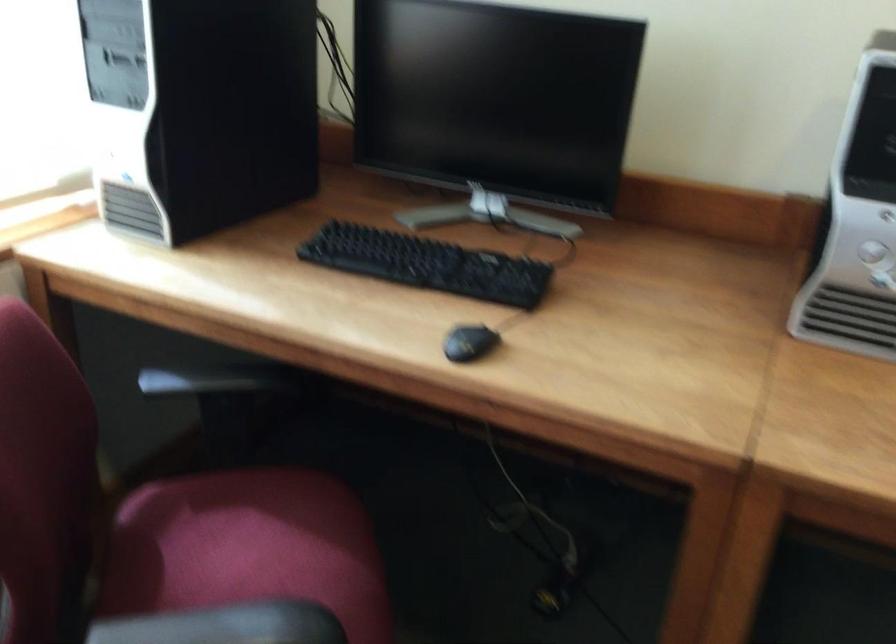
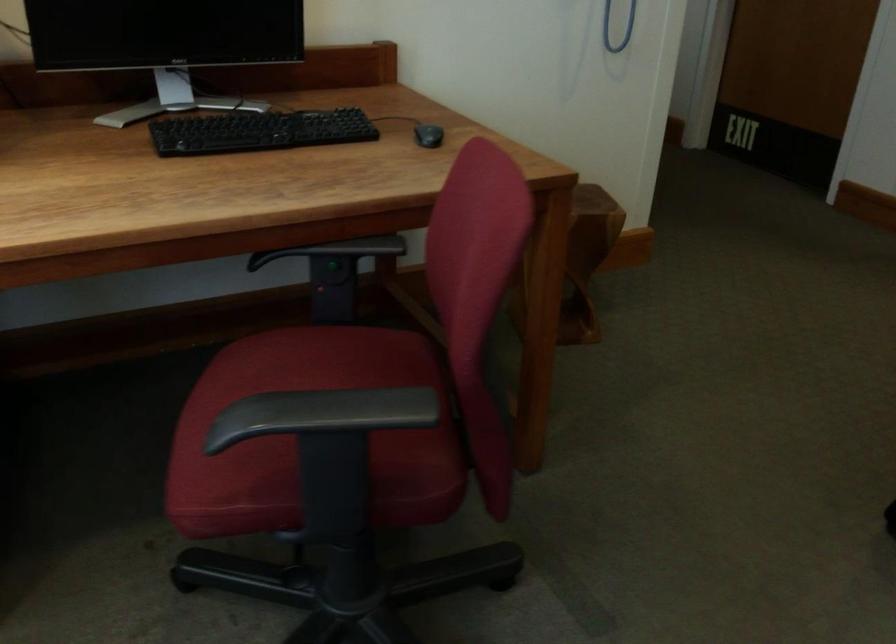
Question: The camera is either moving clockwise (left) or counter-clockwise (right) around the object. The first image is from the beginning of the video and the second image is from the end. Is the camera moving left or right when shooting the video?

Choices:
 (A) Left
 (B) Right

Answer: (A)